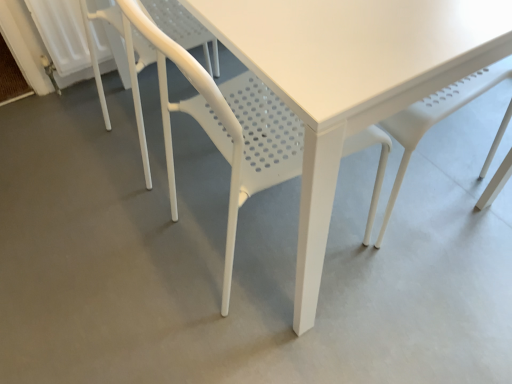
Question: Would you say white plastic chair at center, the second chair in the left-to-right sequence, is part of white plastic chair at lower left, acting as the first chair starting from the left,'s contents?

Choices:
 (A) no
 (B) yes

Answer: (A)

Question: From a real-world perspective, is white plastic chair at lower left, which is the 2th chair in right-to-left order, below white plastic chair at center, the second chair in the left-to-right sequence?

Choices:
 (A) no
 (B) yes

Answer: (B)

Question: Does white plastic chair at lower left, acting as the first chair starting from the left, have a smaller size compared to white plastic chair at center, the second chair in the left-to-right sequence?

Choices:
 (A) no
 (B) yes

Answer: (B)

Question: Considering the relative sizes of white plastic chair at lower left, acting as the first chair starting from the left, and white plastic chair at center, the 1th chair positioned from the right, in the image provided, is white plastic chair at lower left, acting as the first chair starting from the left, shorter than white plastic chair at center, the 1th chair positioned from the right,?

Choices:
 (A) yes
 (B) no

Answer: (A)

Question: Does white plastic chair at lower left, which is the 2th chair in right-to-left order, come behind white plastic chair at center, the second chair in the left-to-right sequence?

Choices:
 (A) yes
 (B) no

Answer: (A)

Question: Does white plastic chair at lower left, acting as the first chair starting from the left, appear on the left side of white plastic chair at center, the 1th chair positioned from the right?

Choices:
 (A) yes
 (B) no

Answer: (A)

Question: Could white plastic chair at lower left, acting as the first chair starting from the left, be considered to be inside white plastic chair at center, the 1th chair positioned from the right?

Choices:
 (A) no
 (B) yes

Answer: (A)

Question: From the image's perspective, is white plastic chair at center, the 1th chair positioned from the right, below white plastic chair at lower left, acting as the first chair starting from the left?

Choices:
 (A) no
 (B) yes

Answer: (B)

Question: Is white plastic chair at center, the 1th chair positioned from the right, touching white plastic chair at lower left, which is the 2th chair in right-to-left order?

Choices:
 (A) yes
 (B) no

Answer: (B)

Question: Does white plastic chair at center, the 1th chair positioned from the right, come behind white plastic chair at lower left, acting as the first chair starting from the left?

Choices:
 (A) yes
 (B) no

Answer: (B)

Question: Is white plastic chair at center, the 1th chair positioned from the right, outside of white plastic chair at lower left, acting as the first chair starting from the left?

Choices:
 (A) no
 (B) yes

Answer: (B)

Question: Is there a large distance between white plastic chair at center, the 1th chair positioned from the right, and white plastic chair at lower left, acting as the first chair starting from the left?

Choices:
 (A) yes
 (B) no

Answer: (B)

Question: Is point [x=170, y=1] positioned closer to the camera than point [x=362, y=130]?

Choices:
 (A) closer
 (B) farther

Answer: (B)